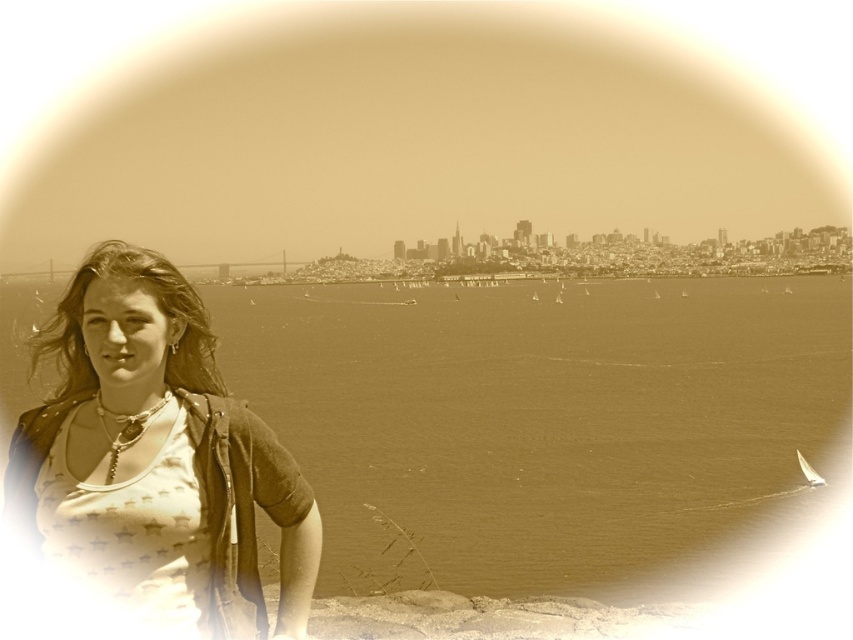
You are a photographer trying to capture the cityscape across the water. You notice the brown water at center and the matte beige tank top at left in your frame. Which object is closer to the left edge of the photo?

The matte beige tank top at left is closer to the left edge of the photo because it is positioned on the left side of the brown water at center.

Please describe the exact position of the matte beige tank top at left in the image using coordinates.

The matte beige tank top at left is located at coordinates point [157,458].